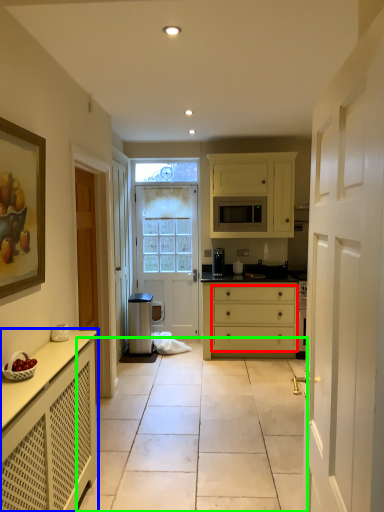
Question: Which is nearer to the drawer (highlighted by a red box)? cabinetry (highlighted by a blue box) or path (highlighted by a green box).

Choices:
 (A) cabinetry
 (B) path

Answer: (B)